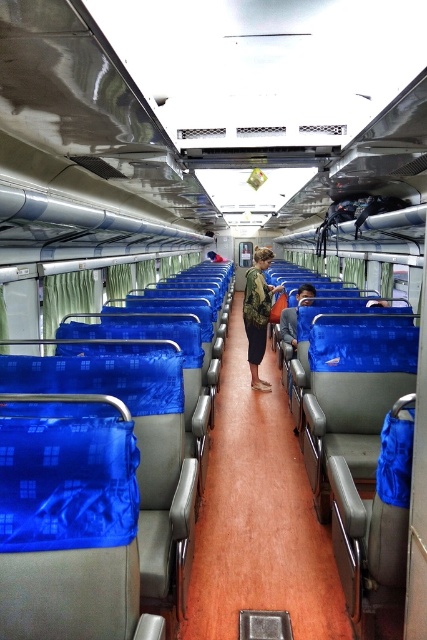
Question: Which point appears closest to the camera in this image?

Choices:
 (A) (265, 552)
 (B) (287, 308)
 (C) (277, 291)

Answer: (A)

Question: Which is nearer to the brown wood floor at center?

Choices:
 (A) blue fabric bag at center
 (B) camouflage-patterned jacket at center

Answer: (B)

Question: Which of the following is the closest to the observer?

Choices:
 (A) (292, 337)
 (B) (274, 483)
 (C) (260, 339)

Answer: (B)

Question: Does brown wood floor at center appear over blue fabric bag at center?

Choices:
 (A) no
 (B) yes

Answer: (A)

Question: Is brown wood floor at center further to camera compared to camouflage-patterned jacket at center?

Choices:
 (A) yes
 (B) no

Answer: (B)

Question: Considering the relative positions of brown wood floor at center and blue fabric bag at center in the image provided, where is brown wood floor at center located with respect to blue fabric bag at center?

Choices:
 (A) right
 (B) left

Answer: (B)